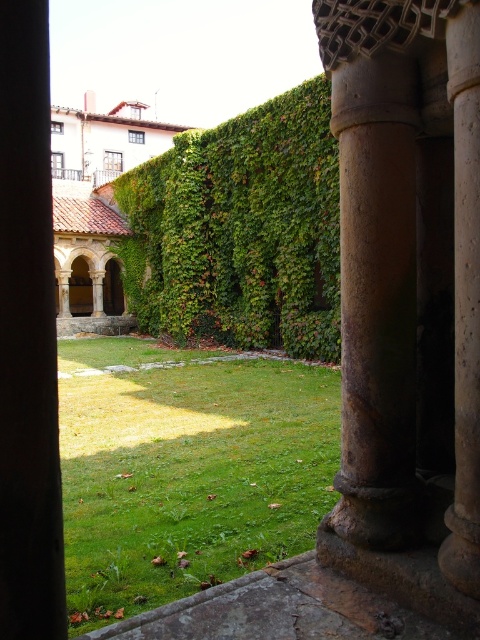
Is point (123, 611) positioned in front of point (4, 216)?

No, it is not.

Is green grass at center positioned behind brown stone pillar at left?

Yes, it is behind brown stone pillar at left.

The height and width of the screenshot is (640, 480). Describe the element at coordinates (186, 468) in the screenshot. I see `green grass at center` at that location.

Image resolution: width=480 pixels, height=640 pixels. What are the coordinates of `green grass at center` in the screenshot? It's located at click(x=186, y=468).

Is point (14, 125) positioned in front of point (456, 333)?

Yes, point (14, 125) is in front of point (456, 333).

Measure the distance between point (x=51, y=385) and camera.

Point (x=51, y=385) is 2.34 meters away from camera.

Which is behind, point (37, 288) or point (448, 17)?

The point (448, 17) is behind.

In order to click on brown stone pillar at left in this screenshot , I will do `click(27, 337)`.

Does green leafy hedge at center appear under brown stone column at right?

Incorrect, green leafy hedge at center is not positioned below brown stone column at right.

Between green leafy hedge at center and brown stone column at right, which one has more height?

green leafy hedge at center is taller.

Based on the photo, who is more forward, [276,262] or [463,346]?

Point [463,346] is in front.

At what (x,y) coordinates should I click in order to perform the action: click on green leafy hedge at center. Please return your answer as a coordinate pair (x, y). Image resolution: width=480 pixels, height=640 pixels. Looking at the image, I should click on (240, 230).